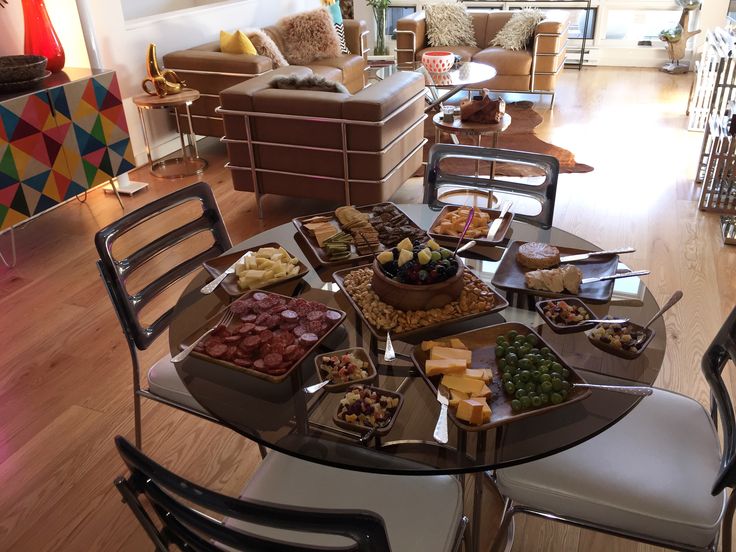
At what (x,y) coordinates should I click in order to perform the action: click on dining table. Please return your answer as a coordinate pair (x, y). This screenshot has width=736, height=552. Looking at the image, I should click on (509, 440).